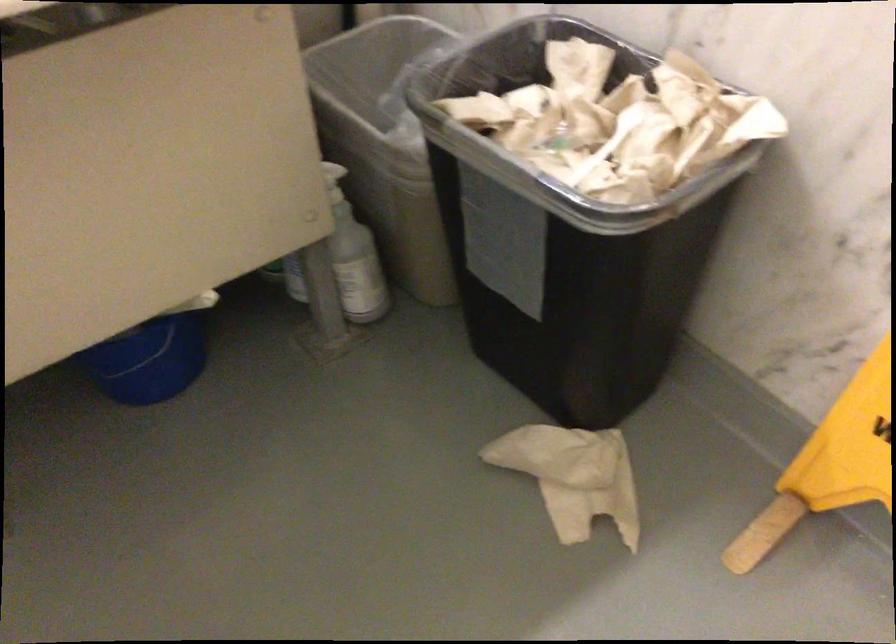
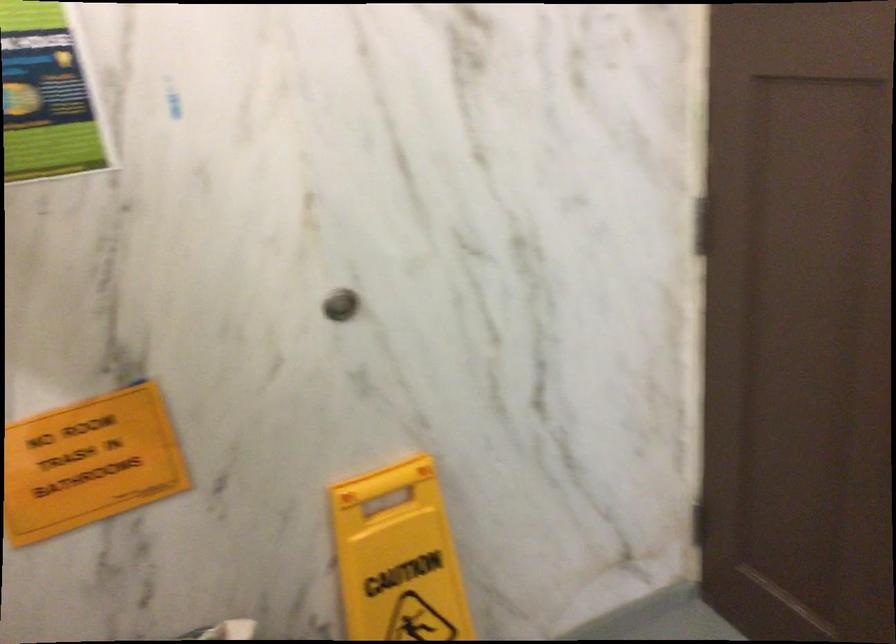
Question: The first image is from the beginning of the video and the second image is from the end. How did the camera likely rotate when shooting the video?

Choices:
 (A) Left
 (B) Right
 (C) Up
 (D) Down

Answer: (B)